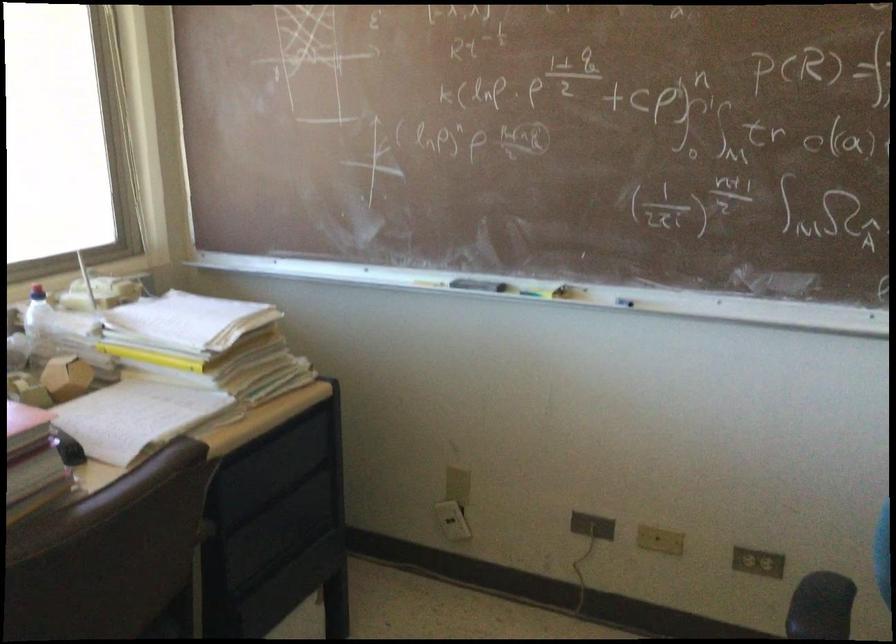
Find where to lift the yellow marker. Please return your answer as a coordinate pair (x, y).

(538, 289)